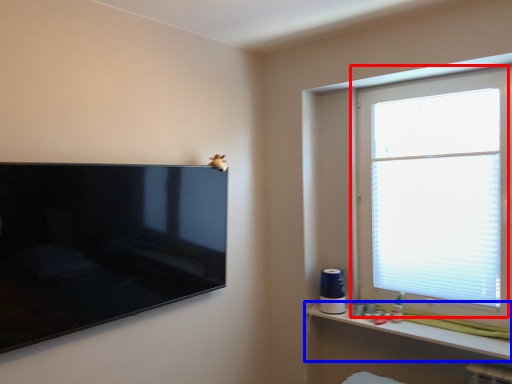
Question: Which of the following is the farthest to the observer, window (highlighted by a red box) or shelf (highlighted by a blue box)?

Choices:
 (A) window
 (B) shelf

Answer: (A)